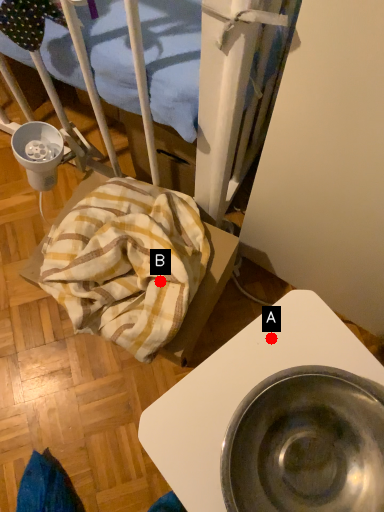
Question: Two points are circled on the image, labeled by A and B beside each circle. Among these points, which one is nearest to the camera?

Choices:
 (A) A is closer
 (B) B is closer

Answer: (A)